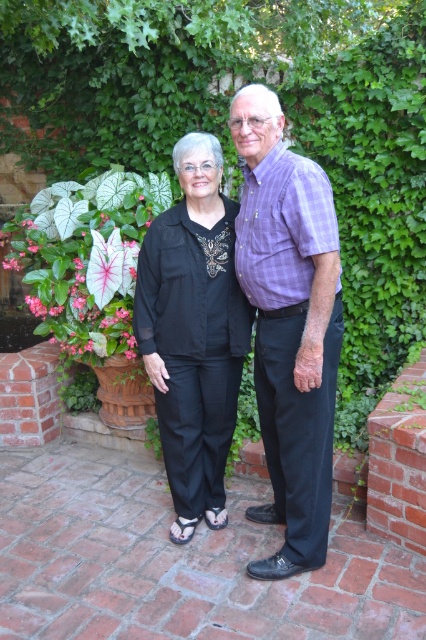
You are a photographer trying to capture a portrait of the two people in the garden. You notice the purple checkered shirt at center and the black cotton pants at center. Which clothing item should you focus on to ensure the subject in the foreground is properly framed?

The purple checkered shirt at center is to the right of the black cotton pants at center, so focusing on the purple checkered shirt at center would place the subject in the foreground properly since it is positioned further forward.

You are a photographer trying to capture a closeup shot of both the purple checkered shirt at center and the black cotton pants at center. Your camera has a maximum focus range of 10 inches. Can you fit both items within the focus range?

The purple checkered shirt at center and black cotton pants at center are 10.80 inches apart from each other. Since the distance between them exceeds the camera focus range of 10 inches, you cannot fit both items within the focus range.